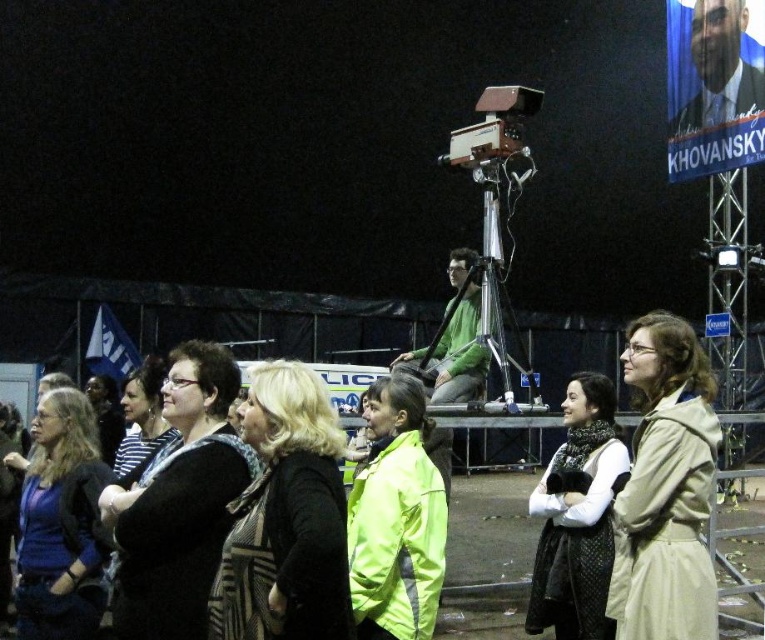
Based on the photo, is matte black jacket at lower left taller than knitted scarf at center?

No, matte black jacket at lower left is not taller than knitted scarf at center.

At what (x,y) coordinates should I click in order to perform the action: click on matte black jacket at lower left. Please return your answer as a coordinate pair (x, y). The height and width of the screenshot is (640, 765). Looking at the image, I should click on (60, 524).

What do you see at coordinates (60, 524) in the screenshot? Image resolution: width=765 pixels, height=640 pixels. I see `matte black jacket at lower left` at bounding box center [60, 524].

The width and height of the screenshot is (765, 640). In order to click on matte black jacket at lower left in this screenshot , I will do point(60,524).

Is beige fabric coat at right shorter than matte black jacket at lower left?

No.

Consider the image. Can you confirm if beige fabric coat at right is bigger than matte black jacket at lower left?

No, beige fabric coat at right is not bigger than matte black jacket at lower left.

Locate an element on the screen. beige fabric coat at right is located at coordinates (669, 484).

Between knitted scarf at center and matte black jacket at center, which one appears on the left side from the viewer's perspective?

matte black jacket at center is more to the left.

Can you confirm if knitted scarf at center is positioned to the left of matte black jacket at center?

In fact, knitted scarf at center is to the right of matte black jacket at center.

Does point (568, 604) come behind point (153, 452)?

Yes, it is.

Find the location of a particular element. This screenshot has height=640, width=765. knitted scarf at center is located at coordinates (578, 516).